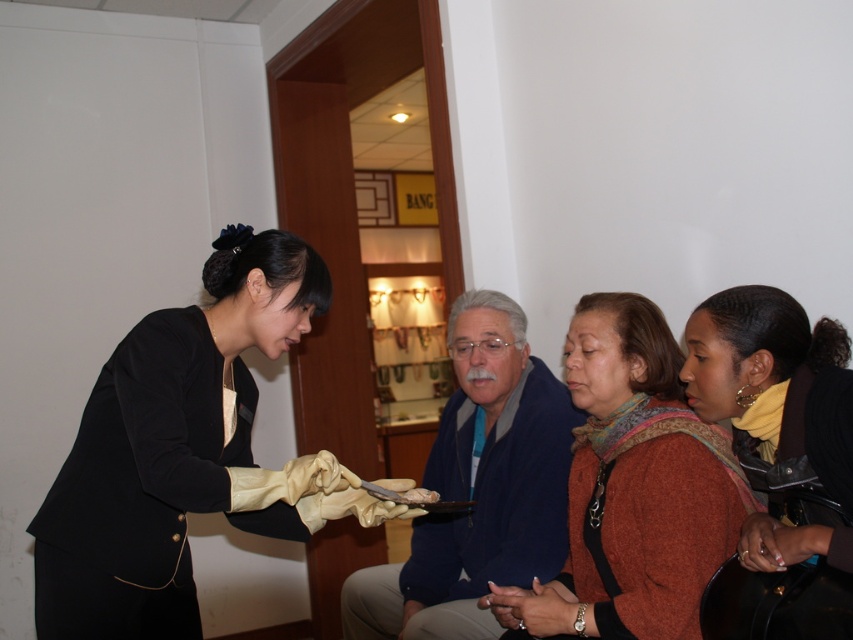
Question: Does knitted wool sweater at center lie behind brown crumbly bread at center?

Choices:
 (A) no
 (B) yes

Answer: (A)

Question: Observing the image, what is the correct spatial positioning of matte black suit at center in reference to white matte ring at lower center?

Choices:
 (A) above
 (B) below

Answer: (A)

Question: Which point is closer to the camera?

Choices:
 (A) click(474, 497)
 (B) click(646, 474)

Answer: (B)

Question: Considering the real-world distances, which object is closest to the brown crumbly bread at center?

Choices:
 (A) knitted wool sweater at center
 (B) matte black suit at center

Answer: (A)

Question: Is knitted wool sweater at center smaller than brown crumbly bread at center?

Choices:
 (A) no
 (B) yes

Answer: (A)

Question: Which of the following is the closest to the observer?

Choices:
 (A) (543, 620)
 (B) (843, 360)
 (C) (322, 513)

Answer: (B)